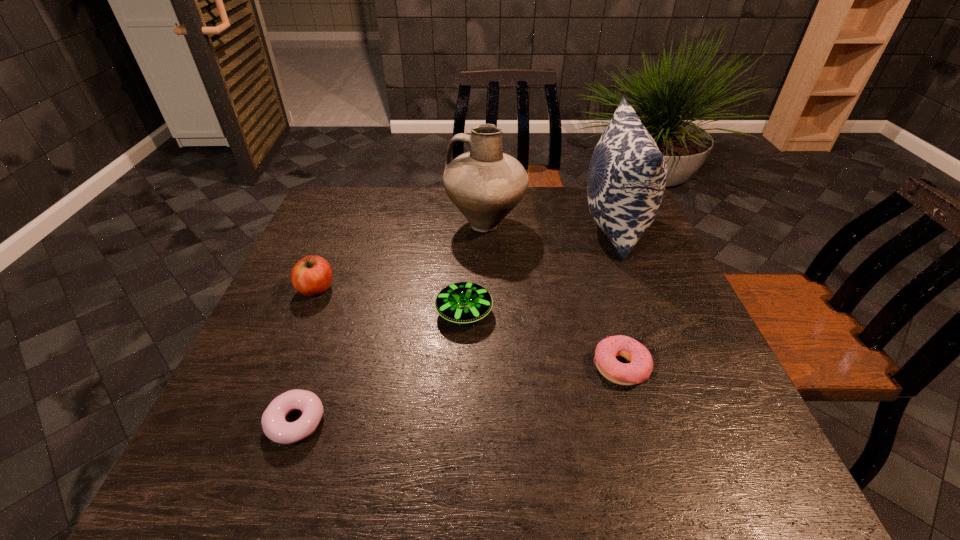
Locate an element on the screen. The height and width of the screenshot is (540, 960). blank space located on the front surface of the cushion is located at coordinates (476, 225).

The image size is (960, 540). What are the coordinates of `vacant space located 0.080m on the handle side of the pitcher` in the screenshot? It's located at (420, 225).

Where is `free location located 0.240m on the handle side of the pitcher`? free location located 0.240m on the handle side of the pitcher is located at coordinates (366, 225).

Locate an element on the screen. This screenshot has height=540, width=960. free location located on the handle side of the pitcher is located at coordinates (383, 225).

I want to click on vacant space situated 0.130m on the right of the third tallest object, so click(386, 289).

Where is `free location located on the right of the saucer`? Image resolution: width=960 pixels, height=540 pixels. free location located on the right of the saucer is located at coordinates (514, 312).

At what (x,y) coordinates should I click in order to perform the action: click on vacant space located on the left of the right doughnut. Please return your answer as a coordinate pair (x, y). Image resolution: width=960 pixels, height=540 pixels. Looking at the image, I should click on (427, 367).

The width and height of the screenshot is (960, 540). Identify the location of free space located 0.360m on the right of the left doughnut. (514, 422).

The height and width of the screenshot is (540, 960). Identify the location of cushion located in the far edge section of the desktop. (627, 174).

This screenshot has width=960, height=540. Identify the location of pitcher present at the far edge. (485, 184).